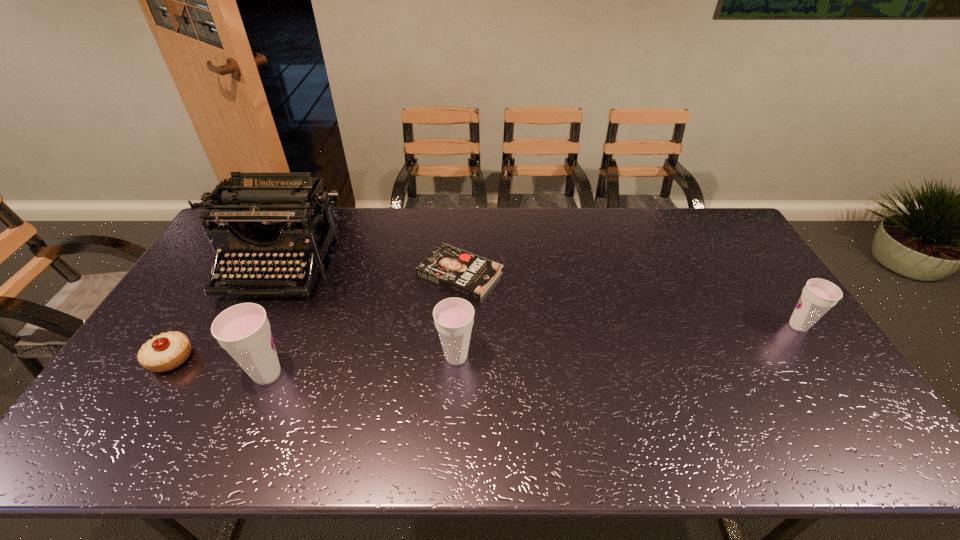
Where is `free space at the far edge of the desktop`? This screenshot has width=960, height=540. free space at the far edge of the desktop is located at coordinates (494, 208).

You are a GUI agent. You are given a task and a screenshot of the screen. Output one action in this format:
    pyautogui.click(x=<x>, y=<y>)
    Task: Click on the vacant space at the near edge of the desktop
    
    Given the screenshot: What is the action you would take?
    pyautogui.click(x=585, y=392)

Identify the location of vacant region at the left edge. (151, 377).

Where is `vacant point at the right edge`? This screenshot has width=960, height=540. vacant point at the right edge is located at coordinates (741, 275).

The height and width of the screenshot is (540, 960). I want to click on free spot between the third shortest object and the typewriter, so (x=539, y=295).

Locate an element on the screen. Image resolution: width=960 pixels, height=540 pixels. vacant point located between the second shortest object and the leftmost cup is located at coordinates pyautogui.click(x=219, y=366).

What are the coordinates of `free spot between the leftmost cup and the rightmost cup` in the screenshot? It's located at (533, 350).

The image size is (960, 540). Find the location of `empty space that is in between the shortest cup and the leftmost cup`. empty space that is in between the shortest cup and the leftmost cup is located at coordinates (533, 350).

This screenshot has height=540, width=960. Find the location of `empty space that is in between the tallest object and the book`. empty space that is in between the tallest object and the book is located at coordinates (370, 270).

Locate an element on the screen. Image resolution: width=960 pixels, height=540 pixels. free space between the leftmost cup and the pastry is located at coordinates (219, 366).